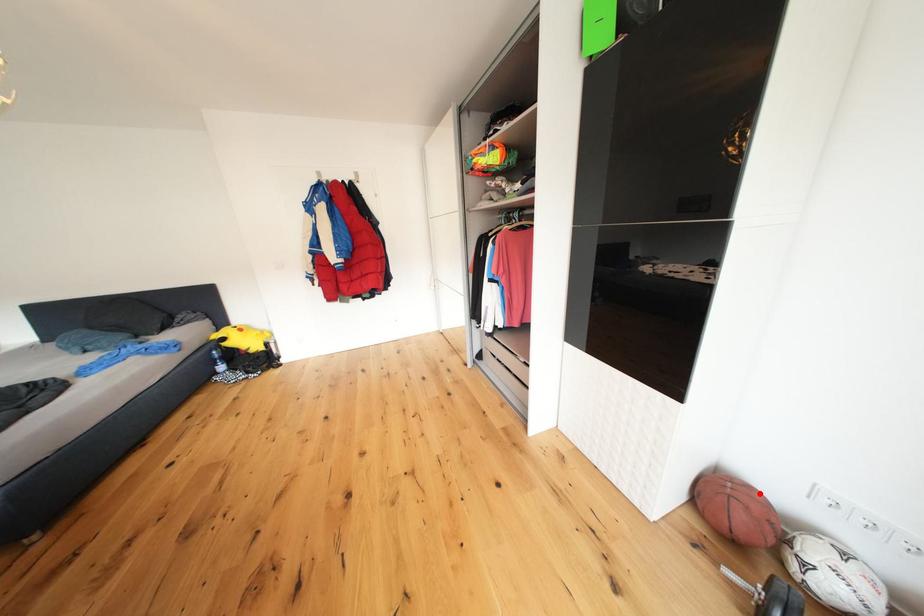
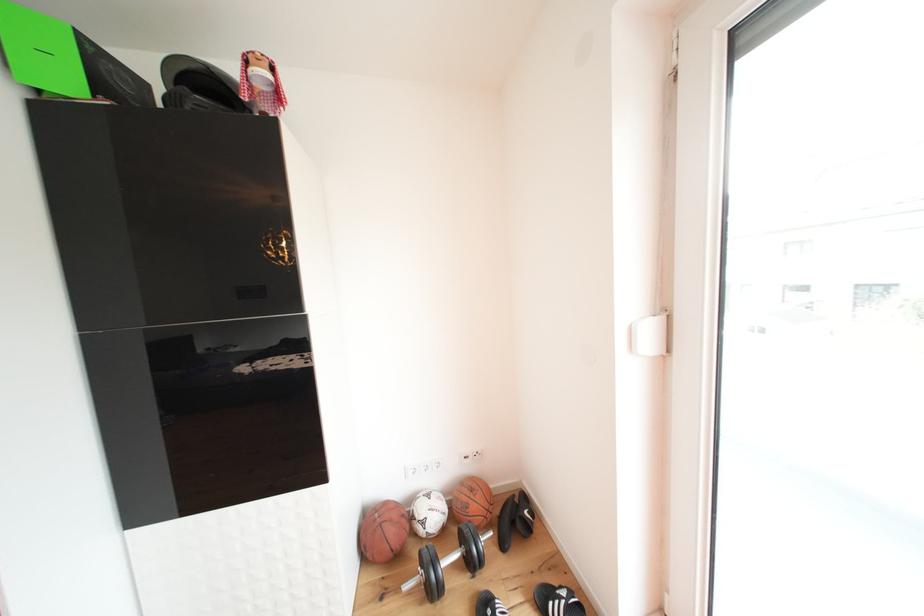
Question: I am providing you with two images of the same scene from different viewpoints. Image1 has a red point marked. In image2, the corresponding 3D location appears at what relative position? Reply with the corresponding letter.

Choices:
 (A) Closer
 (B) Farther

Answer: (B)